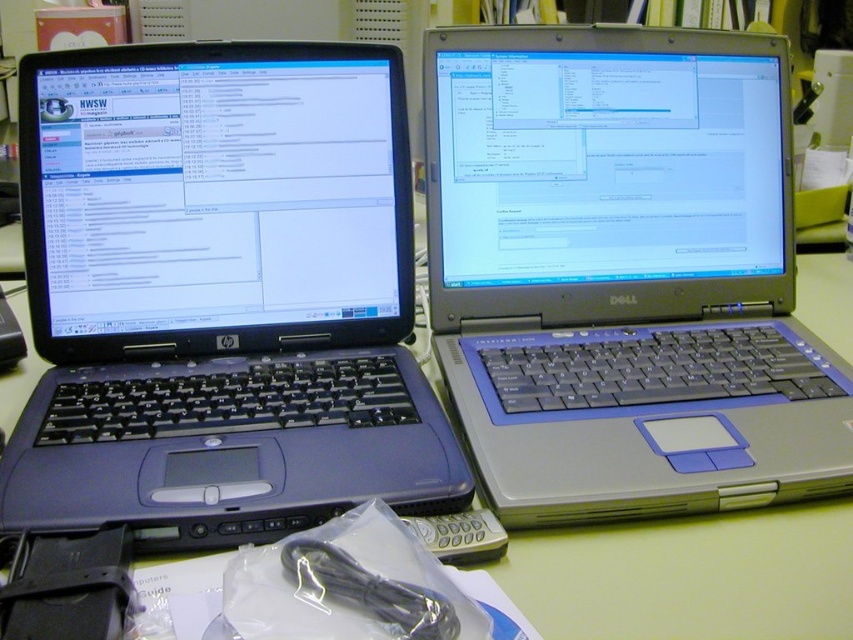
What do you see at coordinates (624, 273) in the screenshot? I see `silver metallic laptop at upper right` at bounding box center [624, 273].

How far apart are silver metallic laptop at upper right and matte plastic computer desk at center?

A distance of 16.30 centimeters exists between silver metallic laptop at upper right and matte plastic computer desk at center.

Where is `silver metallic laptop at upper right`? This screenshot has height=640, width=853. silver metallic laptop at upper right is located at coordinates (624, 273).

Is matte black laptop at left closer to the viewer compared to matte plastic computer desk at center?

No, it is behind matte plastic computer desk at center.

Looking at this image, between matte black laptop at left and matte plastic computer desk at center, which one has less height?

With less height is matte plastic computer desk at center.

Which is in front, point (167, 352) or point (529, 611)?

Positioned in front is point (529, 611).

Locate an element on the screen. This screenshot has height=640, width=853. matte black laptop at left is located at coordinates (219, 294).

Who is more distant from viewer, (198, 298) or (653, 196)?

The point (653, 196) is behind.

Is matte black laptop at left shorter than silver metallic laptop at upper right?

Yes, matte black laptop at left is shorter than silver metallic laptop at upper right.

Find the location of a particular element. matte black laptop at left is located at coordinates (219, 294).